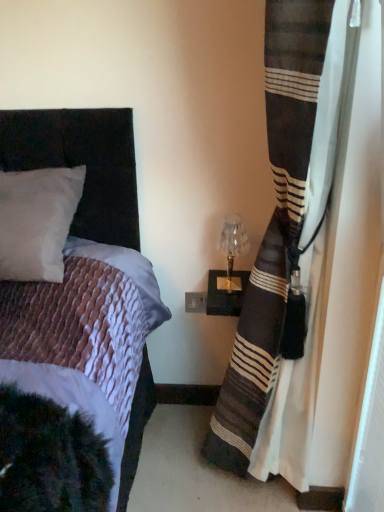
Question: Are striped fabric curtain at right and translucent glass table lamp at upper right far apart?

Choices:
 (A) yes
 (B) no

Answer: (B)

Question: Does striped fabric curtain at right have a smaller size compared to translucent glass table lamp at upper right?

Choices:
 (A) no
 (B) yes

Answer: (A)

Question: Would you say translucent glass table lamp at upper right is part of striped fabric curtain at right's contents?

Choices:
 (A) no
 (B) yes

Answer: (A)

Question: Is the depth of striped fabric curtain at right less than that of translucent glass table lamp at upper right?

Choices:
 (A) no
 (B) yes

Answer: (B)

Question: Is striped fabric curtain at right taller than translucent glass table lamp at upper right?

Choices:
 (A) yes
 (B) no

Answer: (A)

Question: Does striped fabric curtain at right have a larger size compared to translucent glass table lamp at upper right?

Choices:
 (A) yes
 (B) no

Answer: (A)

Question: Considering the relative sizes of translucent glass table lamp at upper right and striped fabric curtain at right in the image provided, is translucent glass table lamp at upper right bigger than striped fabric curtain at right?

Choices:
 (A) yes
 (B) no

Answer: (B)

Question: Considering the relative positions of translucent glass table lamp at upper right and striped fabric curtain at right in the image provided, is translucent glass table lamp at upper right behind striped fabric curtain at right?

Choices:
 (A) yes
 (B) no

Answer: (A)

Question: Is translucent glass table lamp at upper right to the left of striped fabric curtain at right from the viewer's perspective?

Choices:
 (A) no
 (B) yes

Answer: (B)

Question: Would you say translucent glass table lamp at upper right is outside striped fabric curtain at right?

Choices:
 (A) no
 (B) yes

Answer: (B)

Question: Considering the relative sizes of translucent glass table lamp at upper right and striped fabric curtain at right in the image provided, is translucent glass table lamp at upper right taller than striped fabric curtain at right?

Choices:
 (A) no
 (B) yes

Answer: (A)

Question: Is translucent glass table lamp at upper right next to striped fabric curtain at right?

Choices:
 (A) no
 (B) yes

Answer: (A)

Question: Is striped fabric curtain at right wider or thinner than translucent glass table lamp at upper right?

Choices:
 (A) thin
 (B) wide

Answer: (B)